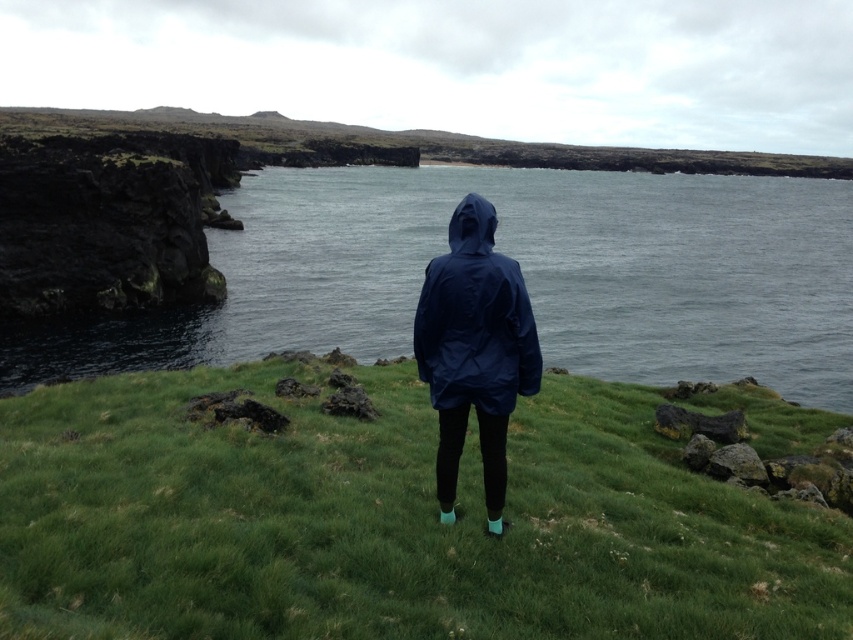
You are a photographer trying to capture the perfect shot of the two points in the scene. Which point, point (531, 420) or point (474, 232), is closer to the camera?

Point (531, 420) is closer to the camera than point (474, 232).

In the scene shown: You are standing on the grassy hillside in the image and want to move towards the sea. Which point, point (27, 596) or point (74, 333), is closer to you as you face the sea?

Point (27, 596) is closer to the camera, so if you are facing the sea and standing on the grassy hillside, point (27, 596) would be closer to you.

You are standing at the point marked by the coordinates point (x=387, y=522). Based on the scene description, what type of terrain are you currently standing on?

The point (x=387, y=522) indicates green grassy at center, so you are standing on green grassy terrain.